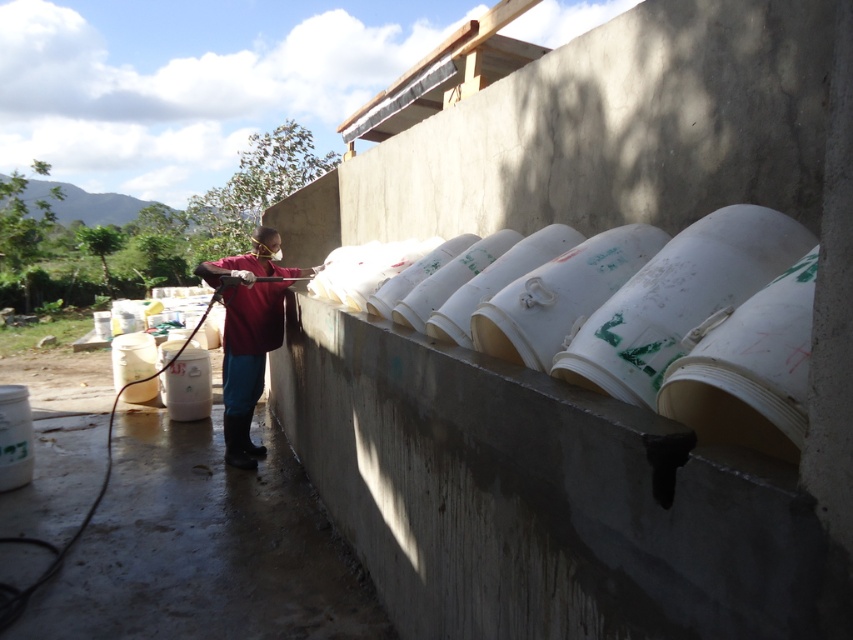
Question: Is smooth concrete floor at lower left above matte red shirt at center?

Choices:
 (A) no
 (B) yes

Answer: (A)

Question: Which of the following is the closest to the observer?

Choices:
 (A) smooth concrete floor at lower left
 (B) matte red shirt at center

Answer: (A)

Question: From the image, what is the correct spatial relationship of smooth concrete floor at lower left in relation to matte red shirt at center?

Choices:
 (A) below
 (B) above

Answer: (A)

Question: Which point is closer to the camera?

Choices:
 (A) smooth concrete floor at lower left
 (B) matte red shirt at center

Answer: (A)

Question: Can you confirm if smooth concrete floor at lower left is wider than matte red shirt at center?

Choices:
 (A) yes
 (B) no

Answer: (A)